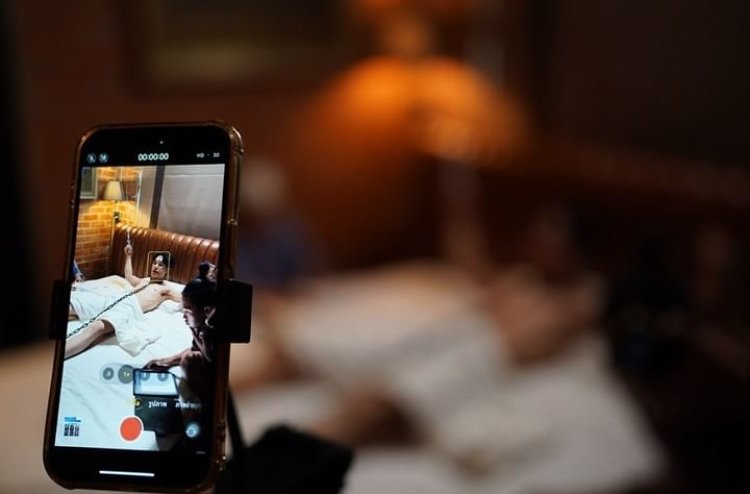
You are a GUI agent. You are given a task and a screenshot of the screen. Output one action in this format:
    pyautogui.click(x=<x>, y=<y>)
    Task: Click on the headboard
    
    Given the screenshot: What is the action you would take?
    pyautogui.click(x=192, y=247), pyautogui.click(x=572, y=169)